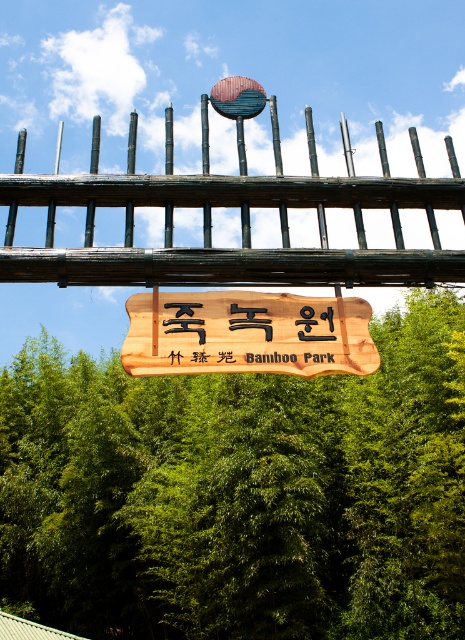
Can you confirm if weathered wood fence at upper center is taller than wooden sign at center?

Incorrect, weathered wood fence at upper center's height is not larger of wooden sign at center's.

What do you see at coordinates (240, 221) in the screenshot? I see `weathered wood fence at upper center` at bounding box center [240, 221].

At what (x,y) coordinates should I click in order to perform the action: click on weathered wood fence at upper center. Please return your answer as a coordinate pair (x, y). The width and height of the screenshot is (465, 640). Looking at the image, I should click on (240, 221).

In the scene shown: Can you confirm if green leafy tree at center is smaller than weathered wood fence at upper center?

No, green leafy tree at center is not smaller than weathered wood fence at upper center.

Does green leafy tree at center appear under weathered wood fence at upper center?

Yes, green leafy tree at center is below weathered wood fence at upper center.

The width and height of the screenshot is (465, 640). I want to click on green leafy tree at center, so click(x=239, y=493).

The height and width of the screenshot is (640, 465). Find the location of `green leafy tree at center`. green leafy tree at center is located at coordinates (239, 493).

Does green leafy tree at center have a larger size compared to wooden sign at center?

Yes, green leafy tree at center is bigger than wooden sign at center.

Is point (406, 516) farther from camera compared to point (347, 369)?

Yes, it is.

Locate an element on the screen. green leafy tree at center is located at coordinates (239, 493).